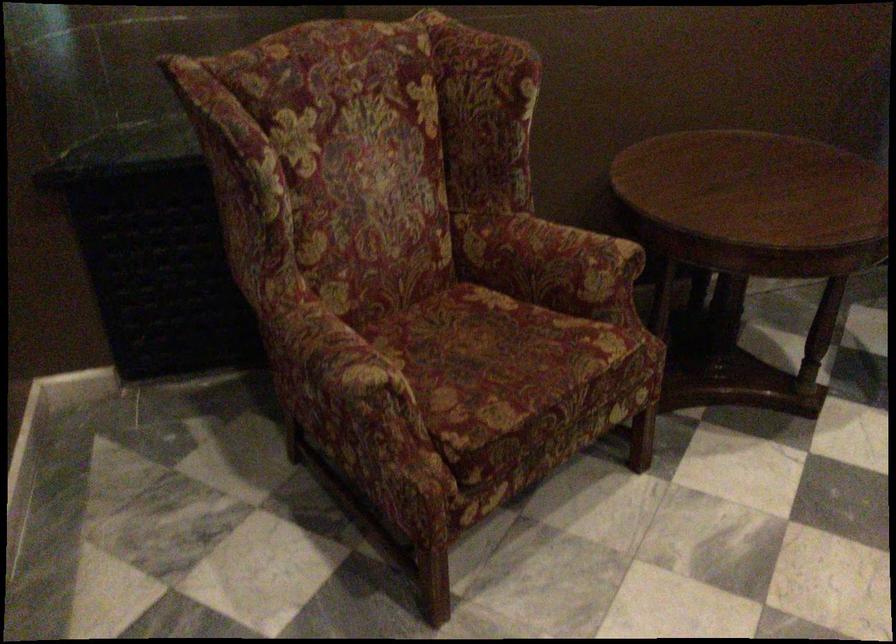
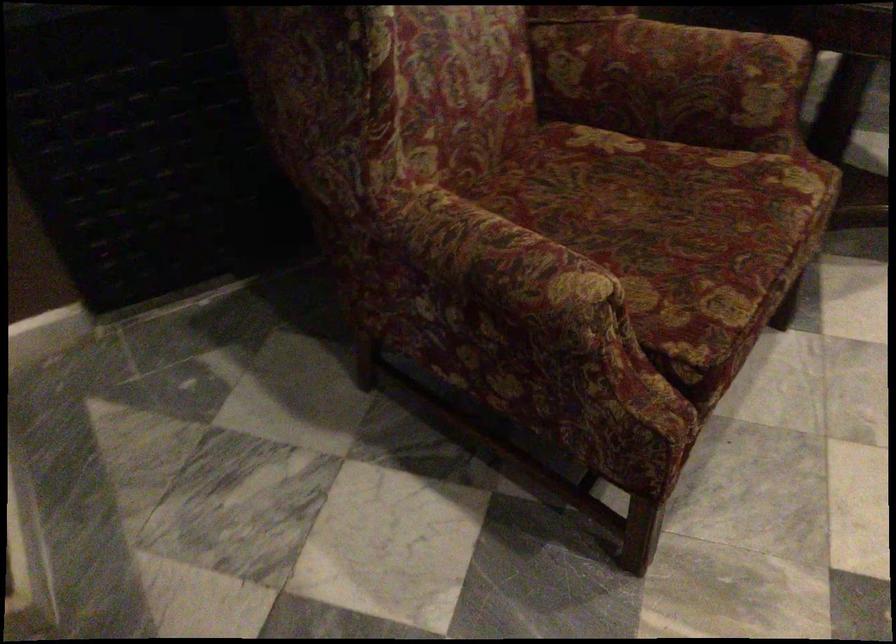
What movement of the cameraman would produce the second image?

The cameraman walked toward left, forward.